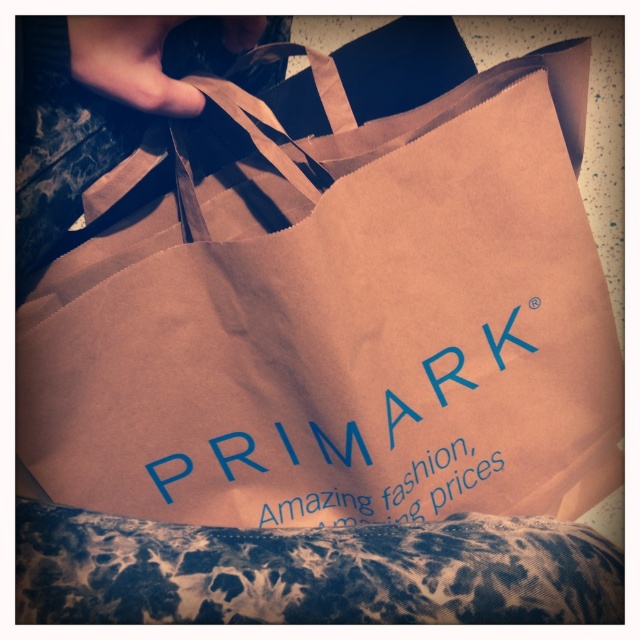
You are arranging items on a shelf and have the leopard print fabric pillow at lower center and the blue paper bag at center. According to the image, which item is positioned to the left of the other?

The leopard print fabric pillow at lower center is to the left of the blue paper bag at center.

You are organizing a small event and need to place the brown paper bag at center and the leopard print fabric pillow at lower center on a shelf. If you want to arrange them so that the one closer to the viewer is on the left side of the shelf, which object should be placed on the left?

The brown paper bag at center is further to the viewer than the leopard print fabric pillow at lower center. To have the closer object on the left, place the brown paper bag at center on the left side of the shelf.

You are arranging a cozy living room and want to place the leopard print fabric pillow at lower center on a shelf that is 1 meter wide. If the pillow is 30 cm wide, will it fit on the shelf?

The leopard print fabric pillow at lower center is 30 cm wide, so it will fit on the 1 meter wide shelf since 30 cm is less than 100 cm.